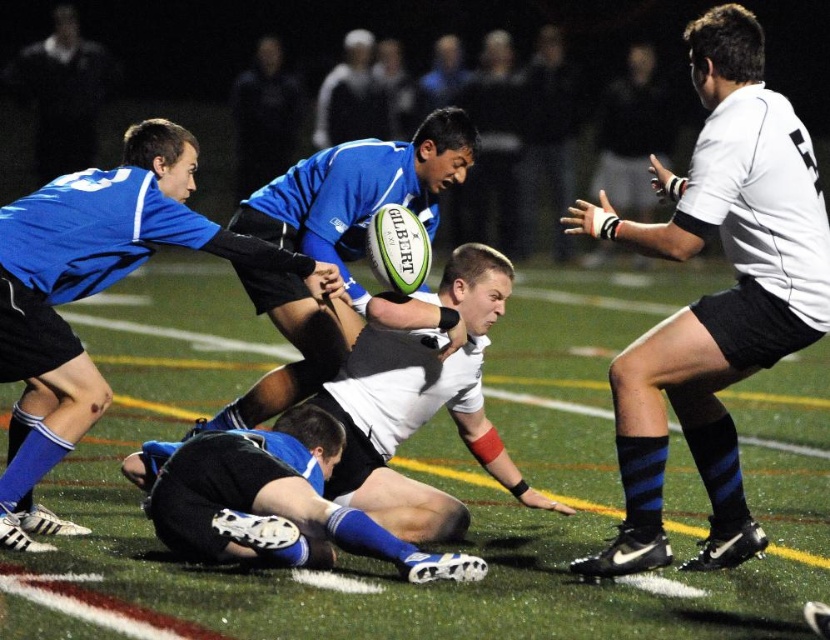
Question: Is blue jersey at upper left to the right of dark blue jersey at upper left from the viewer's perspective?

Choices:
 (A) no
 (B) yes

Answer: (B)

Question: Among these objects, which one is nearest to the camera?

Choices:
 (A) white/black jersey at center
 (B) green turf at center

Answer: (B)

Question: Can you confirm if white/black jersey at center is positioned to the right of blue jersey at upper left?

Choices:
 (A) no
 (B) yes

Answer: (B)

Question: Can you confirm if white/black jersey at center is wider than blue jersey at upper left?

Choices:
 (A) yes
 (B) no

Answer: (B)

Question: Which object is positioned farthest from the blue jersey rugby player at center?

Choices:
 (A) green turf at center
 (B) black synthetic shorts at center

Answer: (A)

Question: Which object is positioned closest to the blue jersey at upper left?

Choices:
 (A) white/black jersey at center
 (B) dark blue jersey at upper left

Answer: (A)